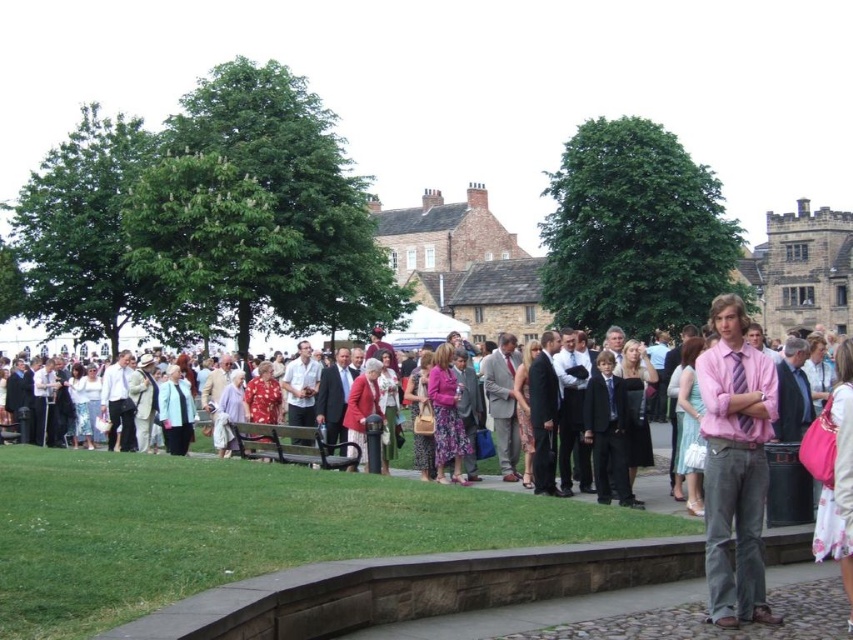
Question: Is pink silk shirt at center below pink satin shirt at right?

Choices:
 (A) no
 (B) yes

Answer: (B)

Question: Does pink silk shirt at center appear over pink satin shirt at right?

Choices:
 (A) yes
 (B) no

Answer: (B)

Question: Which object is closer to the camera taking this photo?

Choices:
 (A) black metal bench at center
 (B) pink satin shirt at right

Answer: (B)

Question: Is pink silk shirt at center positioned before pink satin shirt at right?

Choices:
 (A) no
 (B) yes

Answer: (B)

Question: Estimate the real-world distances between objects in this image. Which object is farther from the black metal bench at center?

Choices:
 (A) pink silk shirt at center
 (B) pink satin shirt at right

Answer: (B)

Question: Which of the following is the closest to the observer?

Choices:
 (A) (352, 460)
 (B) (730, 314)
 (C) (468, 557)

Answer: (C)